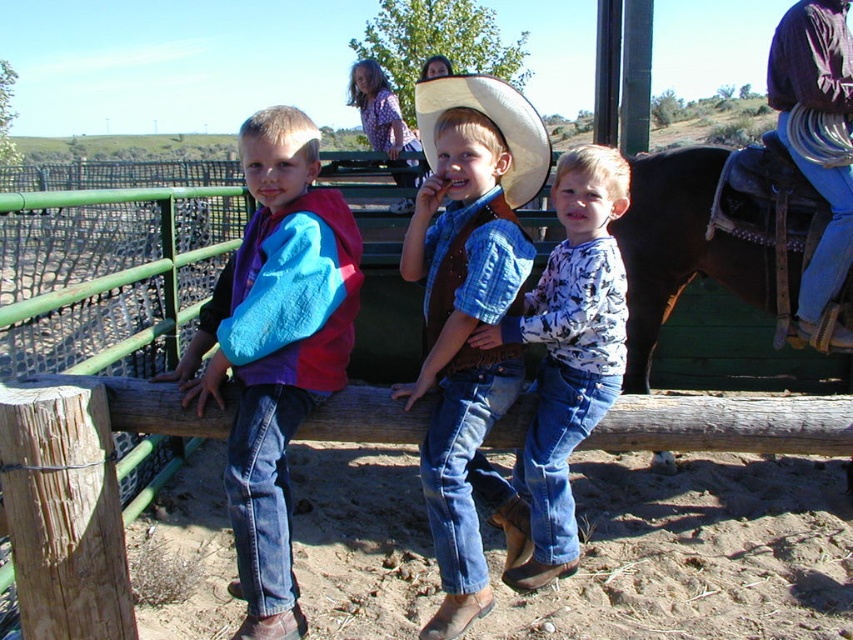
Between denim jeans at center and white printed shirt at center, which one appears on the right side from the viewer's perspective?

white printed shirt at center is more to the right.

Between denim jeans at center and white printed shirt at center, which one appears on the left side from the viewer's perspective?

denim jeans at center is more to the left.

What do you see at coordinates (469, 317) in the screenshot? I see `denim jeans at center` at bounding box center [469, 317].

Identify the location of denim jeans at center. This screenshot has height=640, width=853. (469, 317).

Is point (576, 435) in front of point (509, 177)?

Yes.

Identify the location of white printed shirt at center. This screenshot has height=640, width=853. (569, 352).

Who is more forward, (263, 509) or (817, 92)?

Positioned in front is point (263, 509).

Describe the element at coordinates (276, 348) in the screenshot. The image size is (853, 640). I see `brushed denim jacket at left` at that location.

This screenshot has width=853, height=640. Find the location of `brushed denim jacket at left`. brushed denim jacket at left is located at coordinates (276, 348).